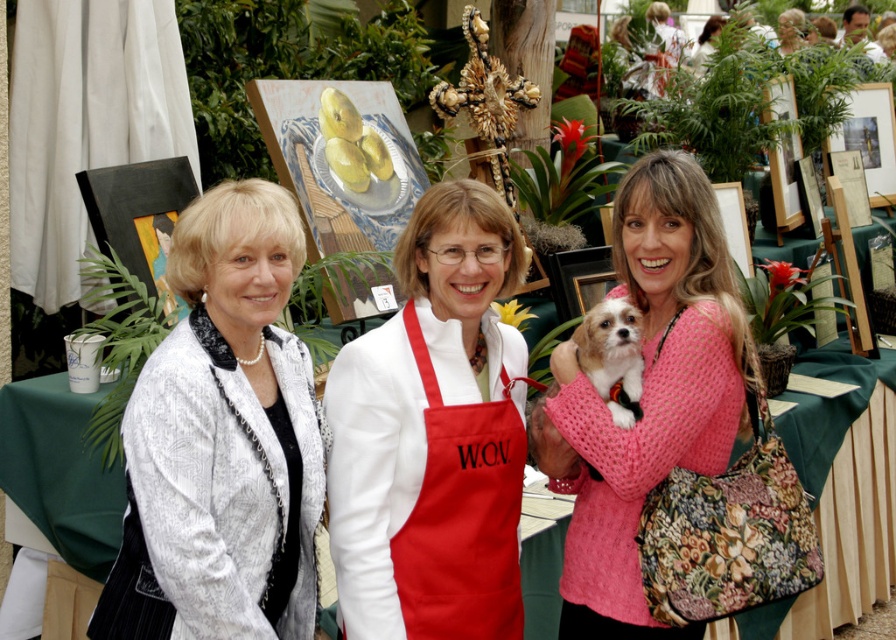
You are a photographer at the art fair and need to position a new participant between the white matte apron at center and the green fabric table at center. Based on their positions, which side should the participant stand on to be between them?

The participant should stand to the right of the white matte apron at center since it is to the left of the green fabric table at center, placing them in between.

You are setting up a table for a craft activity at the art fair. You have a white matte apron at center and a green fabric table at center. Which object is wider?

The white matte apron at center is wider than the green fabric table at center.

You are a photographer at the art fair and want to capture the white matte apron at center and the green fabric table at center in the same frame. Which object is taller?

The white matte apron at center is taller than the green fabric table at center.